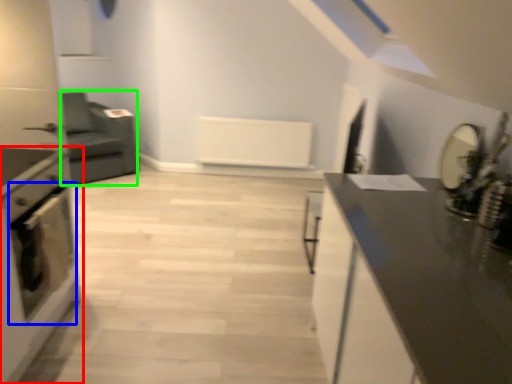
Question: Considering the real-world distances, which object is farthest from home appliance (highlighted by a red box)? oven (highlighted by a blue box) or armchair (highlighted by a green box)?

Choices:
 (A) oven
 (B) armchair

Answer: (B)